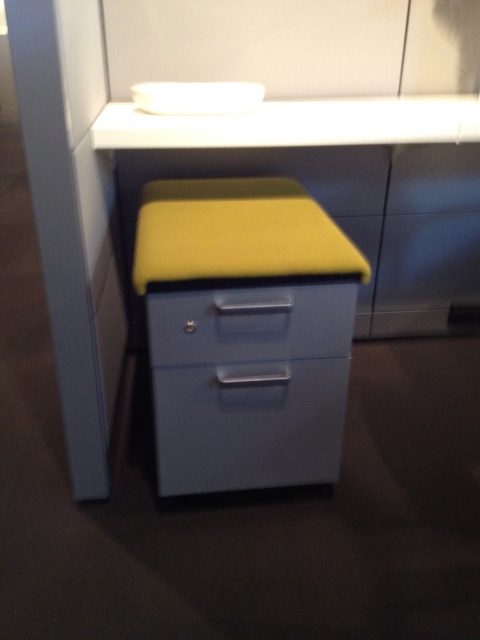
Question: Can you confirm if yellow fabric drawer at center is positioned above matte blue drawer at center?

Choices:
 (A) no
 (B) yes

Answer: (B)

Question: Is matte gray drawer at center thinner than white glossy counter top at upper center?

Choices:
 (A) no
 (B) yes

Answer: (B)

Question: Which is nearer to the white glossy counter top at upper center?

Choices:
 (A) matte gray drawer at center
 (B) matte blue drawer at center
 (C) yellow fabric drawer at center

Answer: (C)

Question: Does matte gray drawer at center come in front of matte blue drawer at center?

Choices:
 (A) yes
 (B) no

Answer: (B)

Question: Among these points, which one is farthest from the camera?

Choices:
 (A) (337, 396)
 (B) (330, 321)
 (C) (208, 289)

Answer: (A)

Question: Which object appears farthest from the camera in this image?

Choices:
 (A) matte gray drawer at center
 (B) white glossy counter top at upper center

Answer: (B)